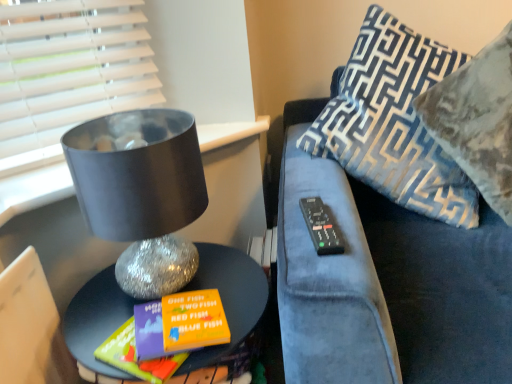
Question: From a real-world perspective, is blue patterned pillow at right, acting as the second pillow starting from the right, on velvet-patterned pillow at upper right, positioned as the second pillow in left-to-right order?

Choices:
 (A) yes
 (B) no

Answer: (A)

Question: Considering the relative positions of blue patterned pillow at right, acting as the second pillow starting from the right, and velvet-patterned pillow at upper right, positioned as the second pillow in left-to-right order, in the image provided, is blue patterned pillow at right, acting as the second pillow starting from the right, to the left of velvet-patterned pillow at upper right, positioned as the second pillow in left-to-right order, from the viewer's perspective?

Choices:
 (A) no
 (B) yes

Answer: (B)

Question: Is the depth of blue patterned pillow at right, which ranks as the first pillow in left-to-right order, less than that of velvet-patterned pillow at upper right, the 1th pillow in the right-to-left sequence?

Choices:
 (A) no
 (B) yes

Answer: (A)

Question: Is blue patterned pillow at right, acting as the second pillow starting from the right, not within velvet-patterned pillow at upper right, the 1th pillow in the right-to-left sequence?

Choices:
 (A) yes
 (B) no

Answer: (B)

Question: Is velvet-patterned pillow at upper right, the 1th pillow in the right-to-left sequence, located within blue patterned pillow at right, acting as the second pillow starting from the right?

Choices:
 (A) no
 (B) yes

Answer: (B)

Question: Considering the positions of point (409, 248) and point (309, 200), is point (409, 248) closer or farther from the camera than point (309, 200)?

Choices:
 (A) closer
 (B) farther

Answer: (B)

Question: From a real-world perspective, relative to black plastic remote at right, is velvet blue couch at upper right vertically above or below?

Choices:
 (A) above
 (B) below

Answer: (B)

Question: In terms of width, does velvet blue couch at upper right look wider or thinner when compared to black plastic remote at right?

Choices:
 (A) thin
 (B) wide

Answer: (B)

Question: Is velvet blue couch at upper right inside or outside of black plastic remote at right?

Choices:
 (A) inside
 (B) outside

Answer: (B)

Question: Based on their positions, is velvet-patterned pillow at upper right, positioned as the second pillow in left-to-right order, located to the left or right of black plastic remote at right?

Choices:
 (A) right
 (B) left

Answer: (A)

Question: Is velvet-patterned pillow at upper right, the 1th pillow in the right-to-left sequence, wider or thinner than black plastic remote at right?

Choices:
 (A) wide
 (B) thin

Answer: (A)

Question: Is velvet-patterned pillow at upper right, the 1th pillow in the right-to-left sequence, situated inside black plastic remote at right or outside?

Choices:
 (A) inside
 (B) outside

Answer: (B)

Question: Is point (488, 187) closer or farther from the camera than point (337, 233)?

Choices:
 (A) closer
 (B) farther

Answer: (B)

Question: Considering the positions of shiny metallic table at lower left and velvet-patterned pillow at upper right, positioned as the second pillow in left-to-right order, in the image, is shiny metallic table at lower left bigger or smaller than velvet-patterned pillow at upper right, positioned as the second pillow in left-to-right order,?

Choices:
 (A) big
 (B) small

Answer: (B)

Question: Is shiny metallic table at lower left taller or shorter than velvet-patterned pillow at upper right, positioned as the second pillow in left-to-right order?

Choices:
 (A) tall
 (B) short

Answer: (B)